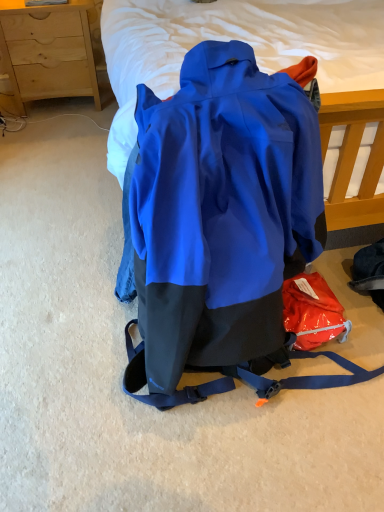
The height and width of the screenshot is (512, 384). What do you see at coordinates (220, 220) in the screenshot?
I see `blue matte backpack at center` at bounding box center [220, 220].

Identify the location of blue matte backpack at center. This screenshot has height=512, width=384. (220, 220).

Locate an element on the screen. The height and width of the screenshot is (512, 384). wooden chest of drawers at upper left is located at coordinates (49, 50).

Describe the element at coordinates (49, 50) in the screenshot. I see `wooden chest of drawers at upper left` at that location.

I want to click on blue matte backpack at center, so click(220, 220).

Can you confirm if wooden chest of drawers at upper left is positioned to the right of blue matte backpack at center?

No, wooden chest of drawers at upper left is not to the right of blue matte backpack at center.

Is wooden chest of drawers at upper left further to the viewer compared to blue matte backpack at center?

Yes, it is.

Between point (38, 62) and point (229, 202), which one is positioned in front?

The point (229, 202) is in front.

From the image's perspective, is wooden chest of drawers at upper left located above blue matte backpack at center?

Yes.

From a real-world perspective, relative to blue matte backpack at center, is wooden chest of drawers at upper left vertically above or below?

Clearly, from a real-world perspective, wooden chest of drawers at upper left is below blue matte backpack at center.

Considering the relative sizes of wooden chest of drawers at upper left and blue matte backpack at center in the image provided, is wooden chest of drawers at upper left wider than blue matte backpack at center?

No, wooden chest of drawers at upper left is not wider than blue matte backpack at center.

Is wooden chest of drawers at upper left shorter than blue matte backpack at center?

Correct, wooden chest of drawers at upper left is not as tall as blue matte backpack at center.

Looking at the image, does wooden chest of drawers at upper left seem bigger or smaller compared to blue matte backpack at center?

Clearly, wooden chest of drawers at upper left is smaller in size than blue matte backpack at center.

Is wooden chest of drawers at upper left positioned beyond the bounds of blue matte backpack at center?

Yes.

Is wooden chest of drawers at upper left next to blue matte backpack at center and touching it?

No, wooden chest of drawers at upper left is not beside blue matte backpack at center.

Is wooden chest of drawers at upper left oriented towards blue matte backpack at center?

Yes, wooden chest of drawers at upper left is oriented towards blue matte backpack at center.

Identify the location of backpack that is above the wooden chest of drawers at upper left (from a real-world perspective). (220, 220).

Considering the relative positions of blue matte backpack at center and wooden chest of drawers at upper left in the image provided, is blue matte backpack at center to the left or to the right of wooden chest of drawers at upper left?

In the image, blue matte backpack at center appears on the right side of wooden chest of drawers at upper left.

Considering the positions of objects blue matte backpack at center and wooden chest of drawers at upper left in the image provided, who is in front, blue matte backpack at center or wooden chest of drawers at upper left?

blue matte backpack at center is more forward.

Considering the points (184, 311) and (46, 22), which point is in front, point (184, 311) or point (46, 22)?

The point (184, 311) is closer.

From the image's perspective, who appears lower, blue matte backpack at center or wooden chest of drawers at upper left?

From the image's view, blue matte backpack at center is below.

From a real-world perspective, is blue matte backpack at center beneath wooden chest of drawers at upper left?

No, from a real-world perspective, blue matte backpack at center is not beneath wooden chest of drawers at upper left.

Does blue matte backpack at center have a lesser width compared to wooden chest of drawers at upper left?

Incorrect, the width of blue matte backpack at center is not less than that of wooden chest of drawers at upper left.

From the picture: Is blue matte backpack at center shorter than wooden chest of drawers at upper left?

No.

Does blue matte backpack at center have a larger size compared to wooden chest of drawers at upper left?

Correct, blue matte backpack at center is larger in size than wooden chest of drawers at upper left.

Is blue matte backpack at center located outside wooden chest of drawers at upper left?

Yes, blue matte backpack at center is outside of wooden chest of drawers at upper left.

Is blue matte backpack at center not close to wooden chest of drawers at upper left?

That's right, there is a large distance between blue matte backpack at center and wooden chest of drawers at upper left.

Looking at this image, is blue matte backpack at center facing towards wooden chest of drawers at upper left?

No, blue matte backpack at center is not aimed at wooden chest of drawers at upper left.

This screenshot has width=384, height=512. What are the coordinates of `backpack on the right side of wooden chest of drawers at upper left` in the screenshot? It's located at (220, 220).

Find the location of a particular element. The width and height of the screenshot is (384, 512). backpack that is above the wooden chest of drawers at upper left (from a real-world perspective) is located at coordinates tap(220, 220).

Find the location of a particular element. This screenshot has height=512, width=384. the chest of drawers beneath the blue matte backpack at center (from a real-world perspective) is located at coordinates (49, 50).